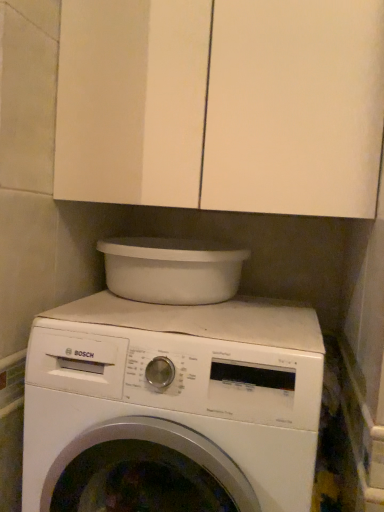
Question: Is white matte washing machine at center to the left or to the right of white matte cabinet at upper center in the image?

Choices:
 (A) left
 (B) right

Answer: (A)

Question: Considering the positions of white matte washing machine at center and white matte cabinet at upper center in the image, is white matte washing machine at center wider or thinner than white matte cabinet at upper center?

Choices:
 (A) wide
 (B) thin

Answer: (A)

Question: Which is nearer to the white matte washing machine at center?

Choices:
 (A) white matte cabinet at upper center
 (B) white plastic basin at upper center

Answer: (B)

Question: Based on their relative distances, which object is farther from the white matte cabinet at upper center?

Choices:
 (A) white plastic basin at upper center
 (B) white matte washing machine at center

Answer: (B)